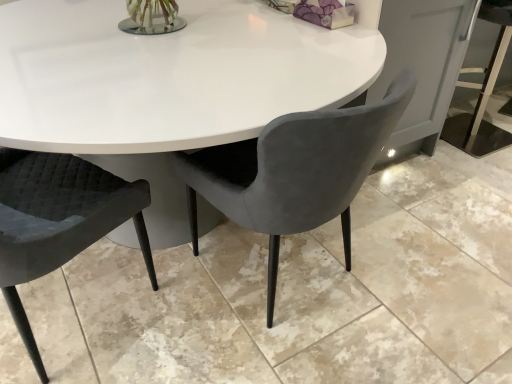
Question: In terms of height, does velvet grey chair at center, acting as the second chair starting from the left, look taller or shorter compared to quilted black chair at lower left, the 1th chair when ordered from left to right?

Choices:
 (A) short
 (B) tall

Answer: (A)

Question: Is velvet grey chair at center, which appears as the first chair when viewed from the right, bigger or smaller than quilted black chair at lower left, the 1th chair when ordered from left to right?

Choices:
 (A) small
 (B) big

Answer: (B)

Question: Which is correct: velvet grey chair at center, acting as the second chair starting from the left, is inside quilted black chair at lower left, the 1th chair when ordered from left to right, or outside of it?

Choices:
 (A) inside
 (B) outside

Answer: (B)

Question: Looking at their shapes, would you say quilted black chair at lower left, which is the 2th chair from right to left, is wider or thinner than velvet grey chair at center, which appears as the first chair when viewed from the right?

Choices:
 (A) thin
 (B) wide

Answer: (A)

Question: In the image, is quilted black chair at lower left, which is the 2th chair from right to left, positioned in front of or behind velvet grey chair at center, acting as the second chair starting from the left?

Choices:
 (A) front
 (B) behind

Answer: (A)

Question: Is quilted black chair at lower left, the 1th chair when ordered from left to right, situated inside velvet grey chair at center, which appears as the first chair when viewed from the right, or outside?

Choices:
 (A) inside
 (B) outside

Answer: (B)

Question: Considering the positions of point pos(52,185) and point pos(349,240), is point pos(52,185) closer or farther from the camera than point pos(349,240)?

Choices:
 (A) closer
 (B) farther

Answer: (A)